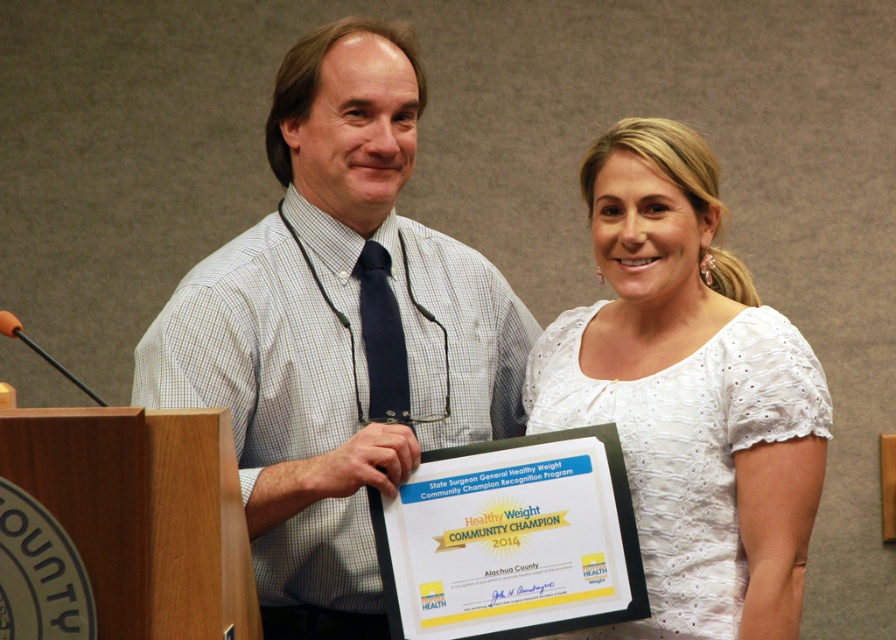
Based on the scene description, what is the spatial relationship between the white checkered shirt at center and the certificate being held by the person on the left?

The white checkered shirt at center is located at point (338, 324), while the certificate is held by the person on the left, but the exact coordinates of the certificate aren

You are a photographer who needs to adjust the lighting to ensure both the white checkered shirt at center and the white lace dress at center are visible. Since one is much taller than the other, where should you position the main light to avoid shadows on both?

The white checkered shirt at center is much taller than the white lace dress at center. To avoid shadows on both, position the main light above and slightly behind the taller object, ensuring even illumination across both subjects.

You are a photographer adjusting your camera to focus on two specific points in the image. The first point is at coordinate point [218,355] and the second is at coordinate point [675,161]. Which point should you focus on first if you want to capture the closest one to the camera?

Point [218,355] is closer to the camera than point [675,161], so you should focus on point [218,355] first.